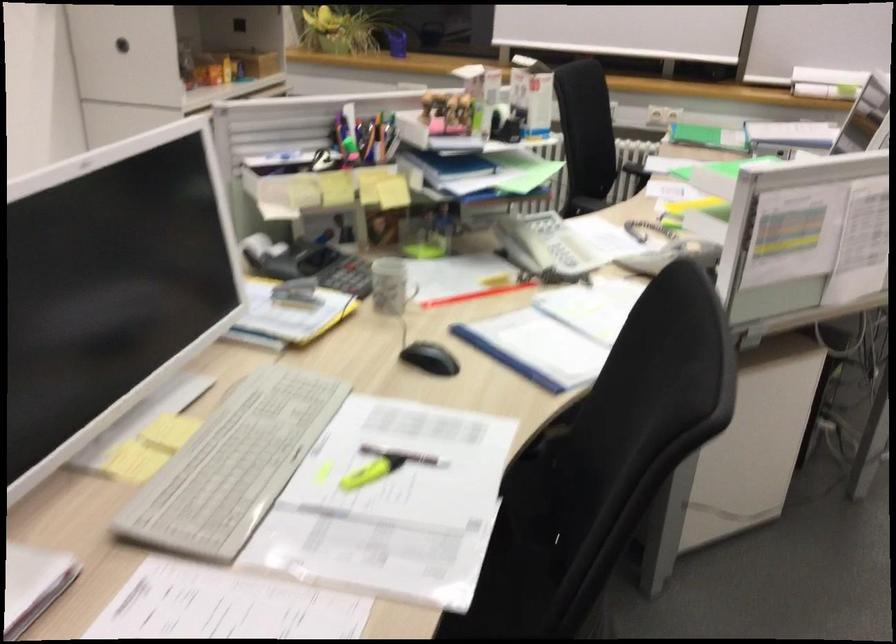
At what (x,y) coordinates should I click in order to perform the action: click on red pencil. Please return your answer as a coordinate pair (x, y). The width and height of the screenshot is (896, 644). Looking at the image, I should click on (475, 295).